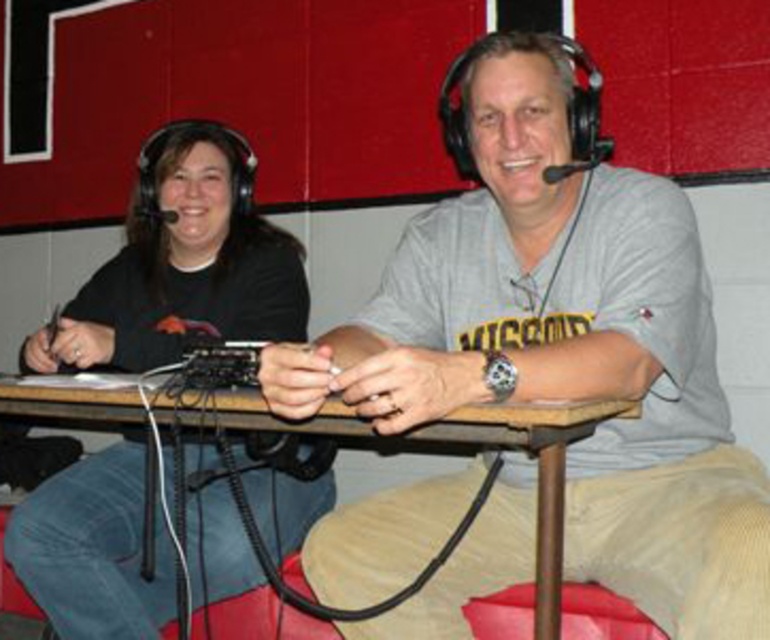
You are a technician in a radio studio. You need to place a microphone stand at the point that is exactly 0.1 units to the right of the black matte headphones at left. What are the coordinates of the point where you should place the microphone stand?

The coordinates of the point to place the microphone stand would be calculated by adding 0.1 to the x coordinate of the black matte headphones at left. The original position is at point (x=182, y=262). Adding 0.1 to the x coordinate gives 0.512, so the new coordinates are (x=182, y=326).

You are a guest speaker in a studio and need to place your 3cm thick notebook on the wooden table at center. Can the black matte headphones at left be placed on the notebook without falling off?

The black matte headphones at left is thinner than wooden table at center, so it can be placed on the notebook without falling off as the headphones are thinner than the table, but the notebook thickness is 3cm. However, the stability depends on the notebook surface. Since the description doesn not mention the notebook surface, assume it can be placed safely.

You are a guest speaker who just entered the studio and need to sit down at the wooden table at center. Which side should you choose to ensure you are closer to the black matte headphones at left?

You should sit on the left side of the wooden table at center because the black matte headphones at left are closer to that side, as they are positioned further towards the viewer compared to the table.